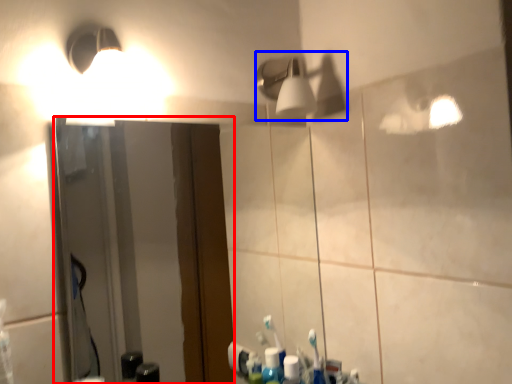
Question: Which object is closer to the camera taking this photo, mirror (highlighted by a red box) or light fixture (highlighted by a blue box)?

Choices:
 (A) mirror
 (B) light fixture

Answer: (A)